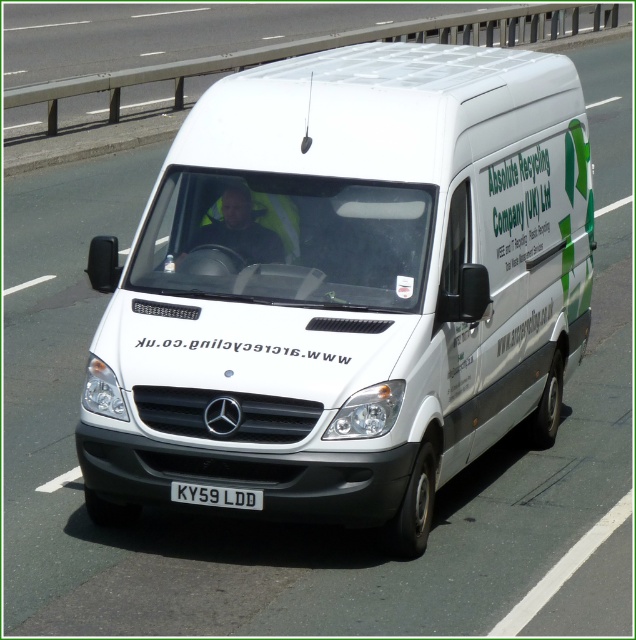
Consider the image. You are a pedestrian standing on the sidewalk next to the highway. You see the white matte van at center and the reflective yellow vest at center. Which object is closer to you?

The reflective yellow vest at center is closer to you because it is only 1.12 meters away from the white matte van at center, but since you are on the sidewalk and the van is on the highway, the vest might be on the van or nearby, but based on the given distance, the vest is closer.